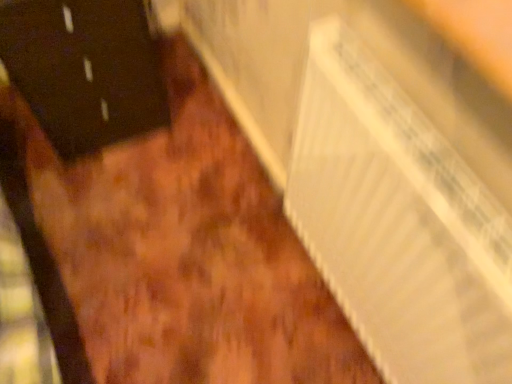
Question: Choose the correct answer: Is white cardboard radiator at lower right inside black matte door at left or outside it?

Choices:
 (A) inside
 (B) outside

Answer: (B)

Question: From the image's perspective, is white cardboard radiator at lower right positioned above or below black matte door at left?

Choices:
 (A) above
 (B) below

Answer: (B)

Question: Is white cardboard radiator at lower right in front of or behind black matte door at left in the image?

Choices:
 (A) front
 (B) behind

Answer: (A)

Question: Does point (134, 21) appear closer or farther from the camera than point (415, 377)?

Choices:
 (A) closer
 (B) farther

Answer: (B)

Question: From a real-world perspective, is black matte door at left above or below white cardboard radiator at lower right?

Choices:
 (A) above
 (B) below

Answer: (B)

Question: Is black matte door at left to the left or to the right of white cardboard radiator at lower right in the image?

Choices:
 (A) left
 (B) right

Answer: (A)

Question: Based on their sizes in the image, would you say black matte door at left is bigger or smaller than white cardboard radiator at lower right?

Choices:
 (A) small
 (B) big

Answer: (B)